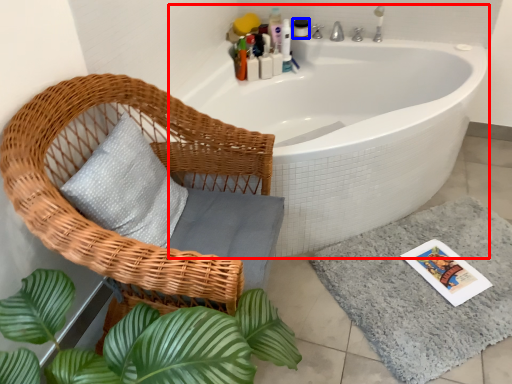
Question: Which object is further to the camera taking this photo, bathtub (highlighted by a red box) or toiletry (highlighted by a blue box)?

Choices:
 (A) bathtub
 (B) toiletry

Answer: (B)